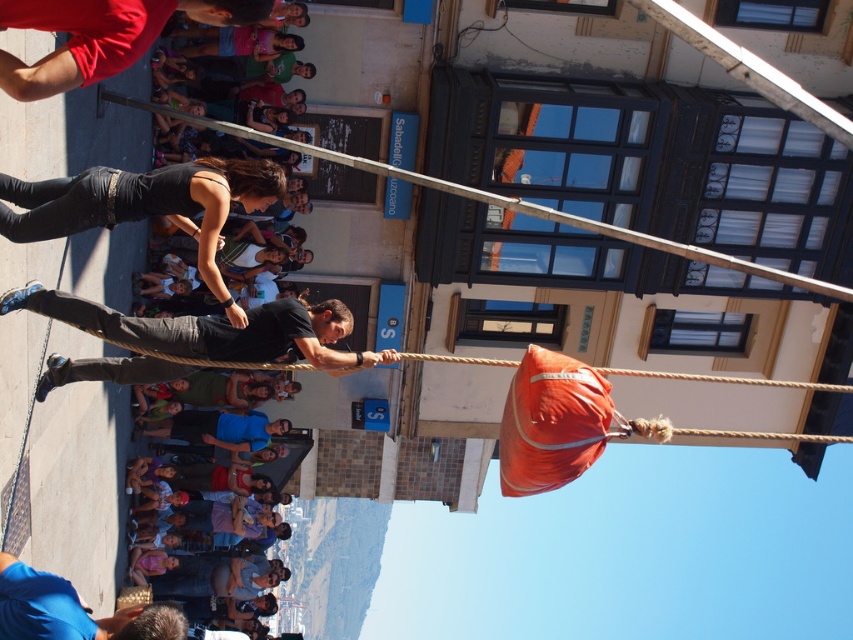
Question: Does black matte shirt at center have a smaller size compared to red fabric shirt at upper left?

Choices:
 (A) yes
 (B) no

Answer: (B)

Question: Among these objects, which one is nearest to the camera?

Choices:
 (A) red fabric shirt at upper left
 (B) black matte shirt at center

Answer: (A)

Question: Is black matte shirt at center bigger than orange fabric bag at center?

Choices:
 (A) no
 (B) yes

Answer: (A)

Question: Which point appears closest to the camera in this image?

Choices:
 (A) (483, 360)
 (B) (254, 356)
 (C) (49, 65)

Answer: (C)

Question: Which object is closer to the camera taking this photo?

Choices:
 (A) red fabric shirt at upper left
 (B) black matte shirt at center
 (C) orange fabric bag at center

Answer: (A)

Question: Is black matte shirt at center closer to the viewer compared to orange fabric bag at center?

Choices:
 (A) no
 (B) yes

Answer: (A)